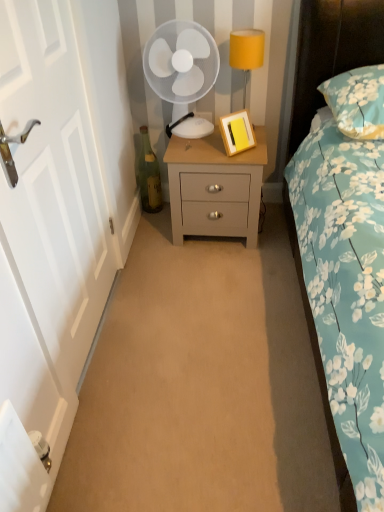
This screenshot has height=512, width=384. What are the coordinates of `white painted wood door at left` in the screenshot? It's located at (46, 242).

At what (x,y) coordinates should I click in order to perform the action: click on light gray wood nightstand at center. Please return your answer as a coordinate pair (x, y). The image size is (384, 512). Looking at the image, I should click on (215, 188).

Find the location of `floral fabric pillow at upper right`. floral fabric pillow at upper right is located at coordinates (357, 101).

Is green glass bottle at lower left looking in the opposite direction of yellow fabric lampshade at upper right?

No, green glass bottle at lower left is not facing away from yellow fabric lampshade at upper right.

Is green glass bottle at lower left to the left of yellow fabric lampshade at upper right from the viewer's perspective?

Correct, you'll find green glass bottle at lower left to the left of yellow fabric lampshade at upper right.

Is green glass bottle at lower left with yellow fabric lampshade at upper right?

No, green glass bottle at lower left is not next to yellow fabric lampshade at upper right.

Can you tell me how much green glass bottle at lower left and yellow fabric lampshade at upper right differ in facing direction?

The facing directions of green glass bottle at lower left and yellow fabric lampshade at upper right are 1.29 degrees apart.

Between yellow fabric lampshade at upper right and light gray wood nightstand at center, which one has more height?

light gray wood nightstand at center is taller.

Looking at this image, measure the distance from yellow fabric lampshade at upper right to light gray wood nightstand at center.

yellow fabric lampshade at upper right is 21.64 inches from light gray wood nightstand at center.

From the image's perspective, does yellow fabric lampshade at upper right appear lower than light gray wood nightstand at center?

Incorrect, from the image's perspective, yellow fabric lampshade at upper right is higher than light gray wood nightstand at center.

Is yellow fabric lampshade at upper right to the left of light gray wood nightstand at center from the viewer's perspective?

No.

Is yellow matte picture frame at center facing away from white painted wood door at left?

No.

Between point (249, 147) and point (51, 440), which one is positioned in front?

The point (51, 440) is closer.

From the image's perspective, would you say yellow matte picture frame at center is shown under white painted wood door at left?

No, from the image's perspective, yellow matte picture frame at center is not below white painted wood door at left.

Between yellow matte picture frame at center and white painted wood door at left, which one is positioned in front?

white painted wood door at left is in front.

Choose the correct answer: Is white plastic fan at upper center inside yellow matte picture frame at center or outside it?

white plastic fan at upper center cannot be found inside yellow matte picture frame at center.

Between white plastic fan at upper center and yellow matte picture frame at center, which one has smaller width?

With smaller width is yellow matte picture frame at center.

Looking at this image, which is farther from the camera, (169, 96) or (229, 114)?

Point (229, 114)

In the image, is light gray wood nightstand at center positioned in front of or behind white painted wood door at left?

In the image, light gray wood nightstand at center appears behind white painted wood door at left.

Is light gray wood nightstand at center outside of white painted wood door at left?

Absolutely, light gray wood nightstand at center is external to white painted wood door at left.

Does light gray wood nightstand at center have a lesser height compared to white painted wood door at left?

Yes, light gray wood nightstand at center is shorter than white painted wood door at left.

Can you tell me how much white painted wood door at left and green glass bottle at lower left differ in facing direction?

white painted wood door at left and green glass bottle at lower left are facing 89.6 degrees away from each other.

Is white painted wood door at left further to camera compared to green glass bottle at lower left?

No, white painted wood door at left is closer to the camera.

Is white painted wood door at left touching green glass bottle at lower left?

No, white painted wood door at left is not making contact with green glass bottle at lower left.

Is white painted wood door at left spatially inside green glass bottle at lower left, or outside of it?

The correct answer is: outside.

Between white plastic fan at upper center and floral fabric pillow at upper right, which one has smaller width?

white plastic fan at upper center is thinner.

Between white plastic fan at upper center and floral fabric pillow at upper right, which one has less height?

floral fabric pillow at upper right.

How far apart are white plastic fan at upper center and floral fabric pillow at upper right?

white plastic fan at upper center is 64.22 centimeters from floral fabric pillow at upper right.

Can you tell me how much white plastic fan at upper center and floral fabric pillow at upper right differ in facing direction?

There is a 2.92-degree angle between the facing directions of white plastic fan at upper center and floral fabric pillow at upper right.

This screenshot has width=384, height=512. Find the location of `bedside lamp on the right of green glass bottle at lower left`. bedside lamp on the right of green glass bottle at lower left is located at coordinates [246, 52].

In the image, there is a light gray wood nightstand at center. At what (x,y) coordinates should I click in order to perform the action: click on bedside lamp above it (from the image's perspective). Please return your answer as a coordinate pair (x, y). The image size is (384, 512). Looking at the image, I should click on (246, 52).

When comparing their distances from white painted wood door at left, does white plastic fan at upper center or yellow matte picture frame at center seem closer?

white plastic fan at upper center is positioned closer to the anchor white painted wood door at left.

Looking at the image, which one is located closer to yellow matte picture frame at center, white plastic fan at upper center or green glass bottle at lower left?

white plastic fan at upper center is closer to yellow matte picture frame at center.

Considering their positions, is white plastic fan at upper center positioned further to yellow matte picture frame at center than floral fabric pillow at upper right?

The object further to yellow matte picture frame at center is floral fabric pillow at upper right.

Estimate the real-world distances between objects in this image. Which object is closer to light gray wood nightstand at center, yellow matte picture frame at center or green glass bottle at lower left?

yellow matte picture frame at center is closer to light gray wood nightstand at center.

Which object lies further to the anchor point yellow fabric lampshade at upper right, light gray wood nightstand at center or floral fabric pillow at upper right?

light gray wood nightstand at center lies further to yellow fabric lampshade at upper right than the other object.

Which object lies nearer to the anchor point yellow fabric lampshade at upper right, white painted wood door at left or floral fabric pillow at upper right?

floral fabric pillow at upper right is closer to yellow fabric lampshade at upper right.

Estimate the real-world distances between objects in this image. Which object is further from green glass bottle at lower left, white plastic fan at upper center or yellow matte picture frame at center?

yellow matte picture frame at center.

From the image, which object appears to be nearer to yellow matte picture frame at center, floral fabric pillow at upper right or yellow fabric lampshade at upper right?

yellow fabric lampshade at upper right is positioned closer to the anchor yellow matte picture frame at center.

Find the location of `picture frame situated between white plastic fan at upper center and yellow fabric lampshade at upper right from left to right`. picture frame situated between white plastic fan at upper center and yellow fabric lampshade at upper right from left to right is located at coordinates (237, 132).

This screenshot has width=384, height=512. I want to click on mechanical fan situated between white painted wood door at left and floral fabric pillow at upper right from left to right, so click(181, 62).

This screenshot has width=384, height=512. What are the coordinates of `mechanical fan located between white painted wood door at left and yellow fabric lampshade at upper right in the depth direction` in the screenshot? It's located at (181, 62).

Where is `nightstand located between green glass bottle at lower left and yellow fabric lampshade at upper right in the left-right direction`? nightstand located between green glass bottle at lower left and yellow fabric lampshade at upper right in the left-right direction is located at coordinates (215, 188).